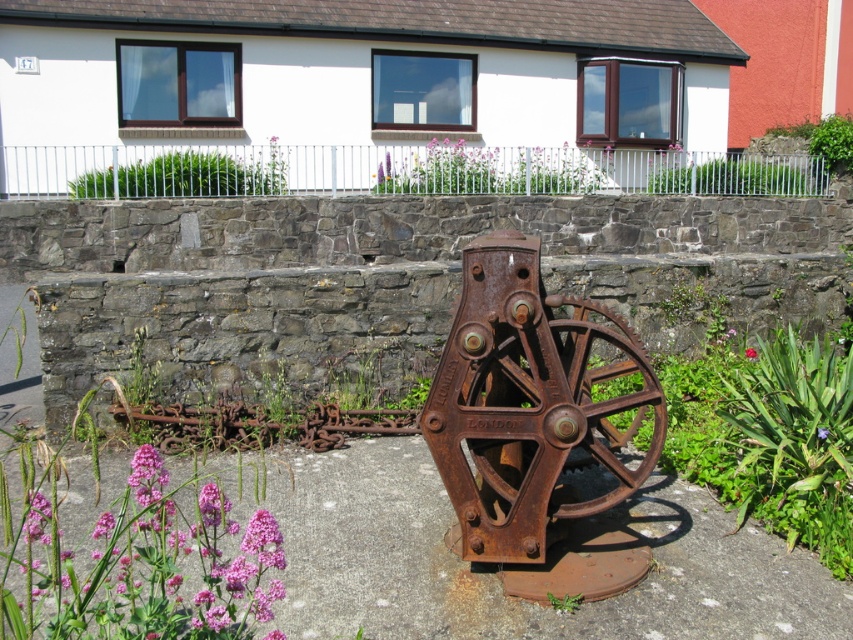
You are standing in front of the large rusted metal wheel and gear assembly. There are two points marked on the ground. One is at coordinate point (59, 637) and the other is at point (747, 355). Which point is nearer to you?

Point (59, 637) is closer to the camera than point (747, 355), so the point at (59, 637) is nearer to you.

You are standing in front of the large rusted metal wheel and gear assembly. There are two points marked in the scene, one at coordinate point (477, 452) and another at point (749, 358). Which of these two points is nearer to you?

Point (477, 452) is closer to the viewer than point (749, 358).

You are a photographer standing at the base of the metal wheel. You want to capture both the pink matte flowers at lower left and the pink matte flower at center in your photo. Which flower is closer to the camera?

The pink matte flowers at lower left is in front of the pink matte flower at center, so it is closer to the camera.